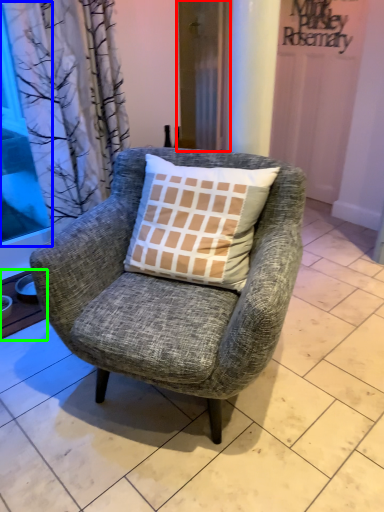
Question: Which object is positioned closest to screen door (highlighted by a red box)? Select from window screen (highlighted by a blue box) and window sill (highlighted by a green box).

Choices:
 (A) window screen
 (B) window sill

Answer: (A)